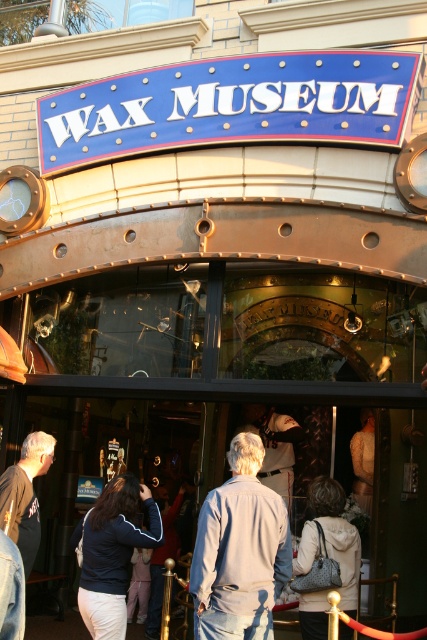
Between point (137, 536) and point (345, 596), which one is positioned in front?

Point (137, 536)

Between point (139, 492) and point (315, 593), which one is positioned in front?

Point (315, 593) is in front.

Find the location of `dark blue jacket at center`. dark blue jacket at center is located at coordinates (111, 552).

Does point (216, 616) lie in front of point (322, 525)?

Yes, point (216, 616) is closer to viewer.

Is light gray denim jacket at center thinner than white textured coat at center?

Correct, light gray denim jacket at center's width is less than white textured coat at center's.

Is point (239, 516) closer to camera compared to point (304, 547)?

That is True.

I want to click on light gray denim jacket at center, so click(x=239, y=550).

Is point (117, 580) in front of point (20, 520)?

Yes, point (117, 580) is in front of point (20, 520).

Which is behind, point (99, 612) or point (32, 486)?

Positioned behind is point (32, 486).

Measure the distance between point (x=114, y=547) and camera.

Point (x=114, y=547) is 17.92 meters from camera.

Locate an element on the screen. dark blue jacket at center is located at coordinates (111, 552).